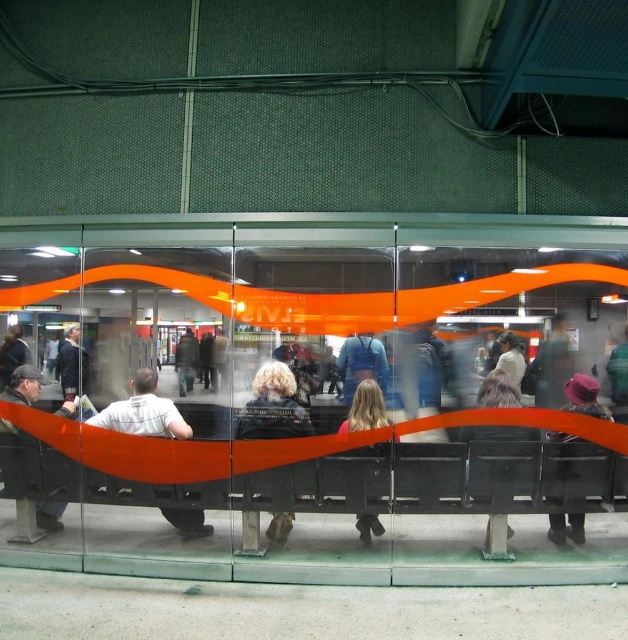
You are a photographer taking a picture of the subway station scene. You notice the blonde hair at center and the matte black jacket at left in your frame. Based on their positions, which object would appear taller in the photo?

The blonde hair at center appears taller than the matte black jacket at left in the photo because the blonde hair at center has a greater height compared to the matte black jacket at left.

You are a commuter waiting at the subway station and notice two jackets on the bench. Which jacket is positioned lower between the matte black jacket at center and the dark blue jacket at center?

The matte black jacket at center is positioned lower as it is located below the dark blue jacket at center.

You are standing in the subway station and see the point marked at coordinates (273, 406). What does this point represent?

The point at (273, 406) represents the location of the blonde hair at center.